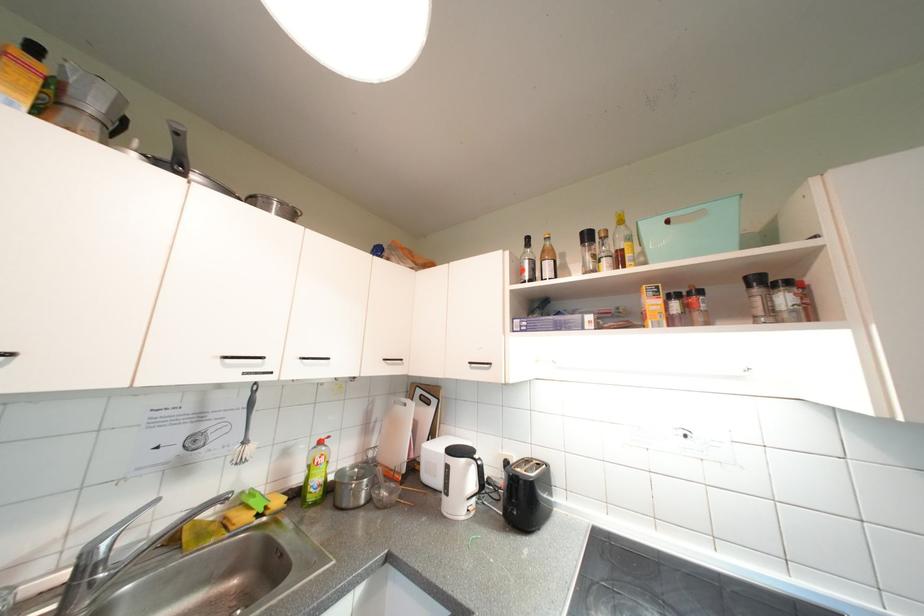
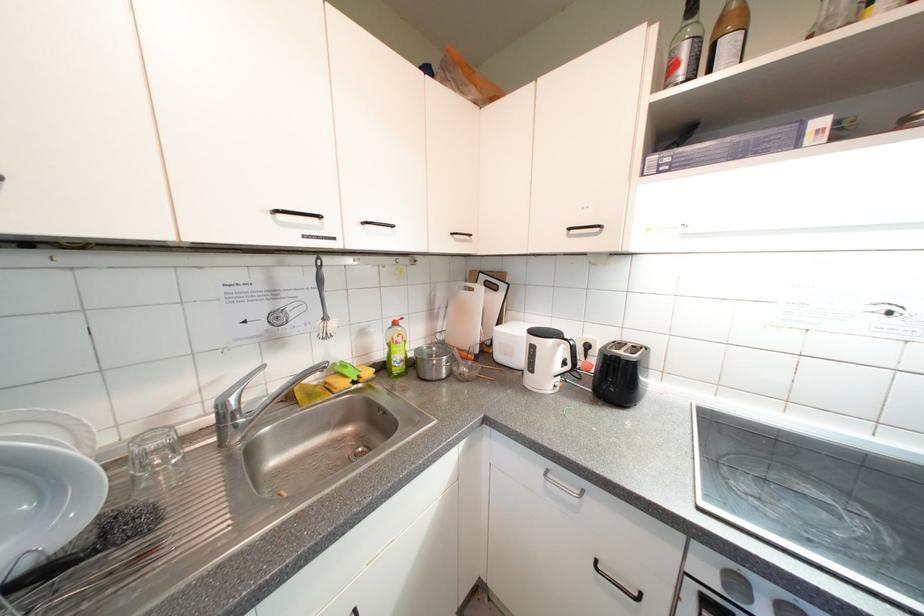
Question: I am providing you with two images of the same scene from different viewpoints. After the viewpoint changes to image2, which objects are now occluded?

Choices:
 (A) clear glass bottle
 (B) brown glass bottle
 (C) green soap bottle
 (D) none of these

Answer: (D)